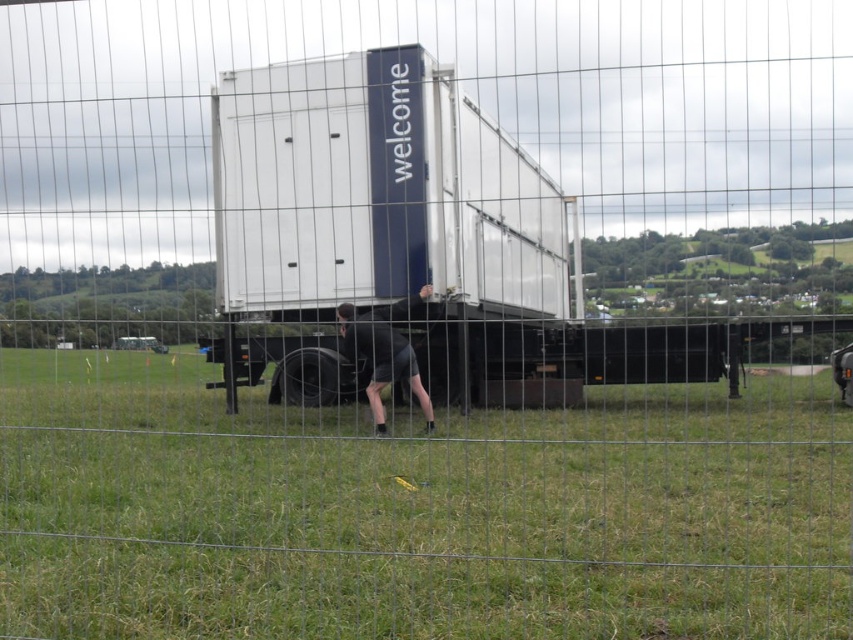
Question: Is the position of white matte truck at center less distant than that of black matte shorts at lower center?

Choices:
 (A) yes
 (B) no

Answer: (A)

Question: From the image, what is the correct spatial relationship of green grass at lower center in relation to black matte shorts at lower center?

Choices:
 (A) right
 (B) left

Answer: (A)

Question: Which object is farther from the camera taking this photo?

Choices:
 (A) green grass at lower center
 (B) white matte truck at center
 (C) black matte shorts at lower center

Answer: (C)

Question: Which object is the closest to the green grass at lower center?

Choices:
 (A) white matte truck at center
 (B) black matte shorts at lower center

Answer: (B)

Question: Can you confirm if green grass at lower center is thinner than white matte truck at center?

Choices:
 (A) yes
 (B) no

Answer: (B)

Question: Based on their relative distances, which object is nearer to the black matte shorts at lower center?

Choices:
 (A) white matte truck at center
 (B) green grass at lower center

Answer: (B)